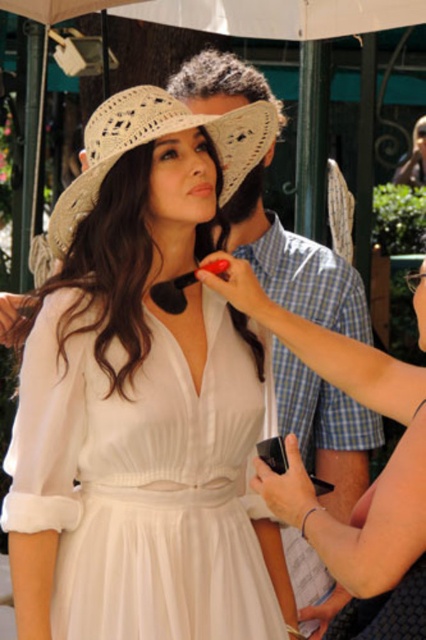
You are a fashion designer observing the outfit of the woman in the image. Which item of clothing or accessory is larger in size between the white chiffon dress at center and the woven straw hat at upper center?

The white chiffon dress at center is bigger than the woven straw hat at upper center.

Based on the scene description, which dress is positioned lower on the woman? The white chiffon dress at center or the white matte dress at center?

The white chiffon dress at center is positioned lower than the white matte dress at center.

In the scene shown: In the scene described, where is the white chiffon dress at center in relation to the woven straw hat at upper center?

The white chiffon dress at center is to the left of the woven straw hat at upper center.